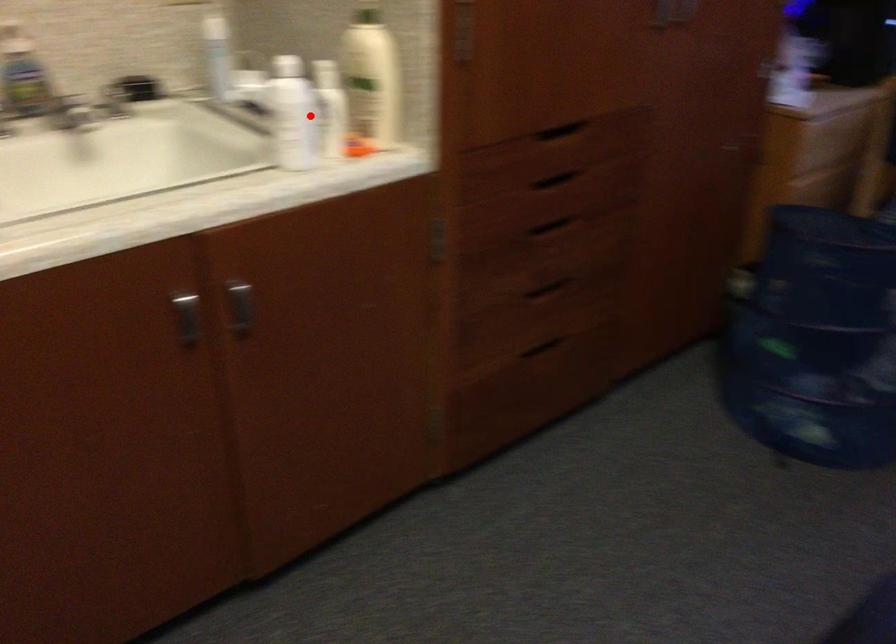
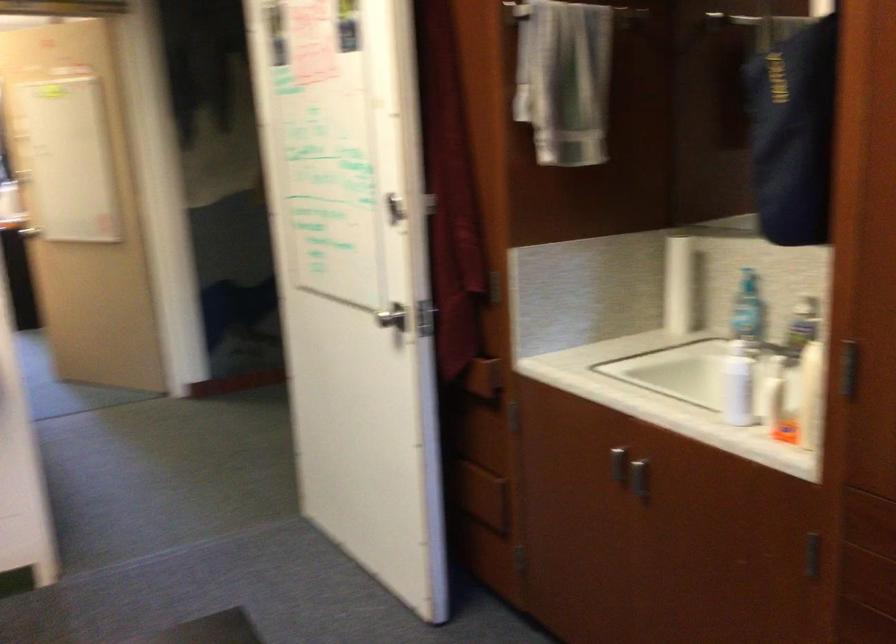
Question: I am providing you with two images of the same scene from different viewpoints. A red point is marked on the first image. At the location where the point appears in image 1, is it still visible in image 2?

Choices:
 (A) Yes
 (B) No

Answer: (A)